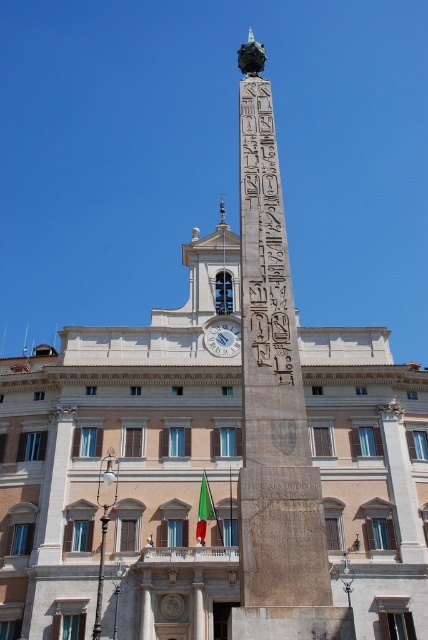
Does black stone hieroglyphs at center appear under white marble clock at center?

Actually, black stone hieroglyphs at center is above white marble clock at center.

From the picture: Can you confirm if black stone hieroglyphs at center is thinner than white marble clock at center?

In fact, black stone hieroglyphs at center might be wider than white marble clock at center.

The height and width of the screenshot is (640, 428). I want to click on black stone hieroglyphs at center, so click(264, 248).

The image size is (428, 640). What do you see at coordinates (273, 406) in the screenshot? I see `granite obelisk at center` at bounding box center [273, 406].

Who is lower down, granite obelisk at center or white marble clock at center?

Positioned lower is white marble clock at center.

From the picture: Measure the distance between point (x=330, y=596) and camera.

Point (x=330, y=596) and camera are 18.83 meters apart from each other.

You are a GUI agent. You are given a task and a screenshot of the screen. Output one action in this format:
    pyautogui.click(x=<x>, y=<y>)
    Task: Click on the granite obelisk at center
    
    Given the screenshot: What is the action you would take?
    pyautogui.click(x=273, y=406)

Can you confirm if white marble clock at center is positioned below green fabric flag at lower center?

No, white marble clock at center is not below green fabric flag at lower center.

Who is more forward, (210, 349) or (202, 534)?

Point (202, 534) is in front.

Describe the element at coordinates (222, 337) in the screenshot. I see `white marble clock at center` at that location.

I want to click on white marble clock at center, so click(x=222, y=337).